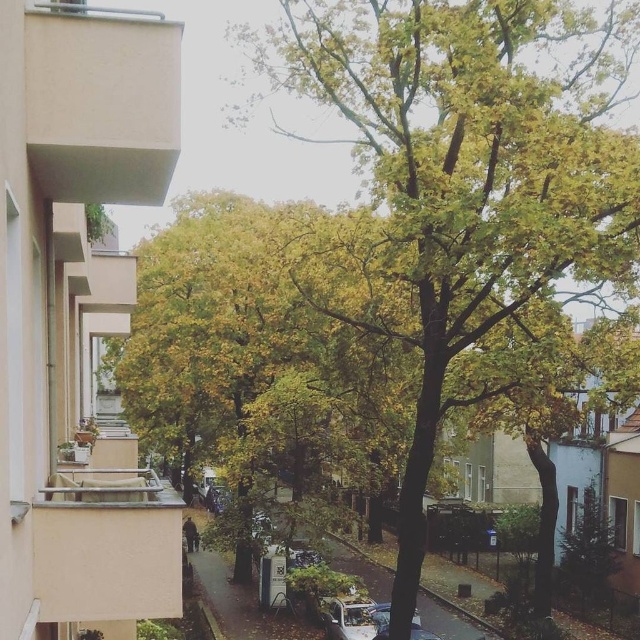
Does green leafy tree at center lie behind metallic silver car at lower center?

No, it is in front of metallic silver car at lower center.

In the scene shown: Is green leafy tree at center shorter than metallic silver car at lower center?

No, green leafy tree at center is not shorter than metallic silver car at lower center.

Who is more distant from viewer, (577, 211) or (413, 620)?

The point (413, 620) is more distant.

The image size is (640, 640). What are the coordinates of `green leafy tree at center` in the screenshot? It's located at tap(470, 170).